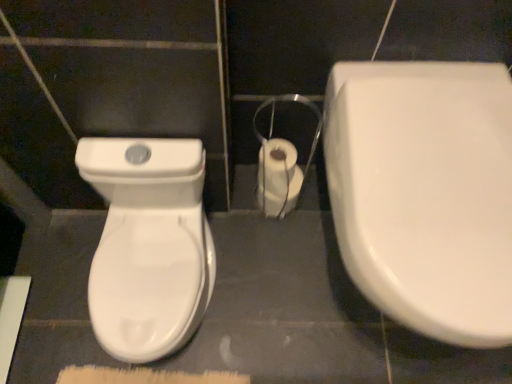
Question: Is the position of white glossy toilet paper at center more distant than that of white glossy toilet at left, which ranks as the 1th toilet in left-to-right order?

Choices:
 (A) no
 (B) yes

Answer: (B)

Question: From the image's perspective, does white glossy toilet paper at center appear lower than white glossy toilet at left, which is counted as the 2th toilet, starting from the right?

Choices:
 (A) yes
 (B) no

Answer: (B)

Question: Does white glossy toilet paper at center have a lesser height compared to white glossy toilet at left, which is counted as the 2th toilet, starting from the right?

Choices:
 (A) no
 (B) yes

Answer: (B)

Question: From the image's perspective, is white glossy toilet paper at center on white glossy toilet at left, which is counted as the 2th toilet, starting from the right?

Choices:
 (A) no
 (B) yes

Answer: (B)

Question: Considering the relative positions of white glossy toilet paper at center and white glossy toilet at left, which ranks as the 1th toilet in left-to-right order, in the image provided, is white glossy toilet paper at center to the left of white glossy toilet at left, which ranks as the 1th toilet in left-to-right order, from the viewer's perspective?

Choices:
 (A) no
 (B) yes

Answer: (A)

Question: Is white glossy toilet paper at center in front of or behind white glossy toilet at right, the first toilet positioned from the right, in the image?

Choices:
 (A) behind
 (B) front

Answer: (A)

Question: Would you say white glossy toilet paper at center is to the left or to the right of white glossy toilet at right, the first toilet positioned from the right, in the picture?

Choices:
 (A) right
 (B) left

Answer: (B)

Question: From the image's perspective, is white glossy toilet paper at center located above or below white glossy toilet at right, the first toilet positioned from the right?

Choices:
 (A) above
 (B) below

Answer: (A)

Question: From a real-world perspective, relative to white glossy toilet at right, which appears as the 2th toilet when viewed from the left, is white glossy toilet paper at center vertically above or below?

Choices:
 (A) above
 (B) below

Answer: (B)

Question: Is white glossy toilet at right, the first toilet positioned from the right, in front of or behind white glossy toilet paper at center in the image?

Choices:
 (A) behind
 (B) front

Answer: (B)

Question: Is point (333, 198) closer or farther from the camera than point (294, 173)?

Choices:
 (A) farther
 (B) closer

Answer: (B)

Question: Looking at their shapes, would you say white glossy toilet at right, which appears as the 2th toilet when viewed from the left, is wider or thinner than white glossy toilet paper at center?

Choices:
 (A) thin
 (B) wide

Answer: (B)

Question: From the image's perspective, relative to white glossy toilet paper at center, is white glossy toilet at right, which appears as the 2th toilet when viewed from the left, above or below?

Choices:
 (A) below
 (B) above

Answer: (A)

Question: From the image's perspective, is white glossy toilet at left, which ranks as the 1th toilet in left-to-right order, above or below white glossy toilet at right, the first toilet positioned from the right?

Choices:
 (A) above
 (B) below

Answer: (B)

Question: From a real-world perspective, is white glossy toilet at left, which is counted as the 2th toilet, starting from the right, physically located above or below white glossy toilet at right, the first toilet positioned from the right?

Choices:
 (A) below
 (B) above

Answer: (A)